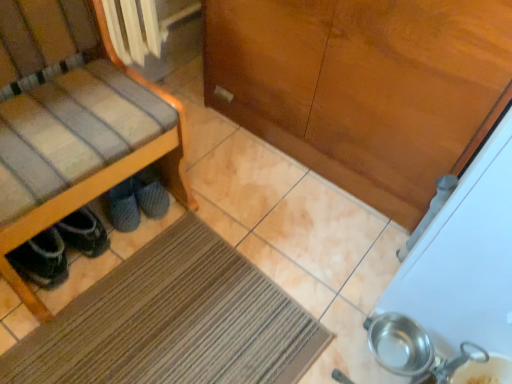
You are a GUI agent. You are given a task and a screenshot of the screen. Output one action in this format:
    pyautogui.click(x=<x>, y=<y>)
    Task: Click on the free spot below brown textured mat at lower center (from a real-world perspective)
    
    Given the screenshot: What is the action you would take?
    pyautogui.click(x=181, y=327)